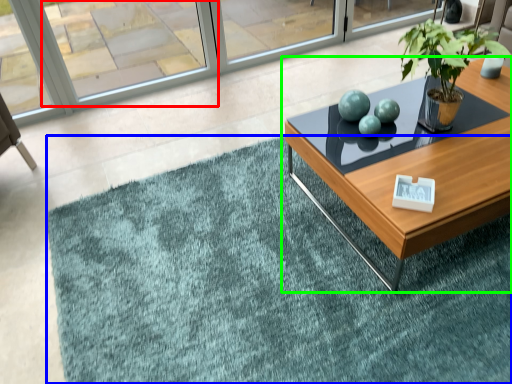
Question: Which object is positioned farthest from window (highlighted by a red box)? Select from doormat (highlighted by a blue box) and coffee table (highlighted by a green box).

Choices:
 (A) doormat
 (B) coffee table

Answer: (A)